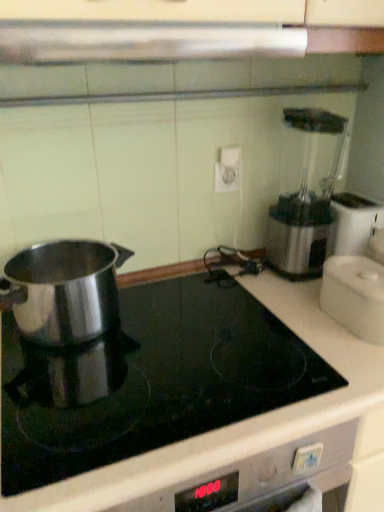
Image resolution: width=384 pixels, height=512 pixels. I want to click on vacant space situated on the left part of white plastic container at right, the third kitchen appliance viewed from the left, so click(x=299, y=325).